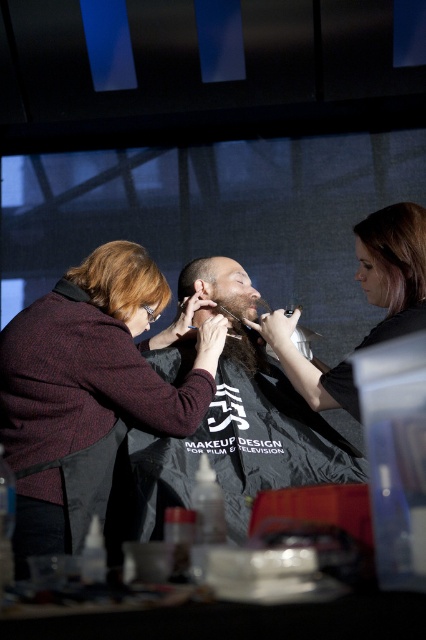
Question: Which of the following is the closest to the observer?

Choices:
 (A) blonde smooth hair at upper right
 (B) matte black hair at center
 (C) dark gray fabric at center
 (D) blonde hair at left

Answer: (C)

Question: Among these objects, which one is nearest to the camera?

Choices:
 (A) blonde smooth hair at upper right
 (B) matte black hair at center
 (C) dark brown hair at center
 (D) dark gray fabric at center

Answer: (D)

Question: Estimate the real-world distances between objects in this image. Which object is farther from the dark brown hair at center?

Choices:
 (A) dark gray fabric at center
 (B) matte black hair at center
 (C) blonde smooth hair at upper right
 (D) blonde hair at left

Answer: (C)

Question: Can you confirm if maroon woolen sweater at upper left is positioned above black matte hair clipper at upper right?

Choices:
 (A) no
 (B) yes

Answer: (A)

Question: Does blonde hair at left have a lesser width compared to dark brown hair at center?

Choices:
 (A) no
 (B) yes

Answer: (A)

Question: Is black matte hair clipper at upper right in front of blonde smooth hair at upper right?

Choices:
 (A) yes
 (B) no

Answer: (A)